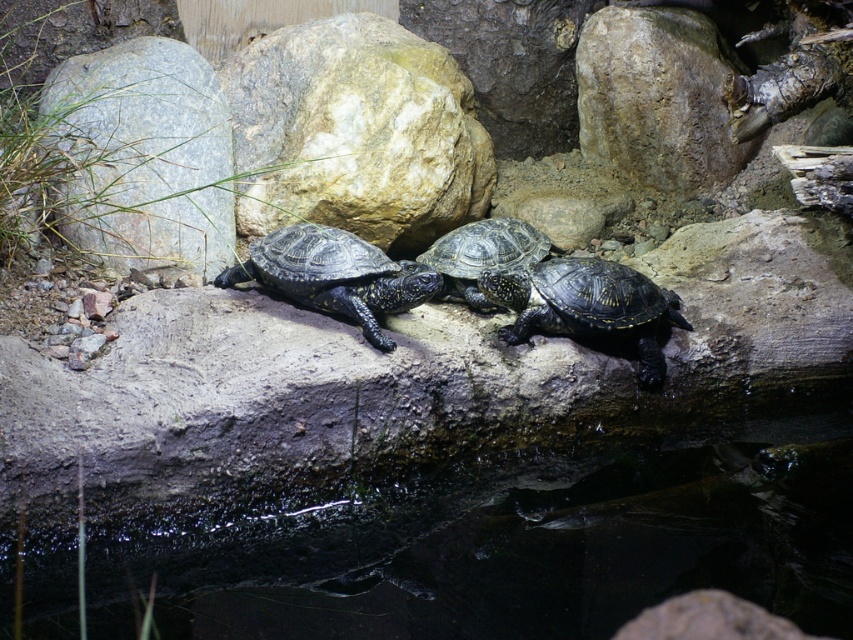
Which is more to the left, speckled rock at center or gray rock at center?

From the viewer's perspective, gray rock at center appears more on the left side.

Does point (381, 188) come in front of point (148, 64)?

Yes, it is.

Which is in front, point (457, 118) or point (172, 60)?

Point (457, 118) is more forward.

The height and width of the screenshot is (640, 853). Identify the location of speckled rock at center. (357, 132).

Does gray rock at center appear on the left side of rough textured rock at upper center?

Yes, gray rock at center is to the left of rough textured rock at upper center.

Describe the element at coordinates (148, 156) in the screenshot. I see `gray rock at center` at that location.

Locate an element on the screen. The width and height of the screenshot is (853, 640). gray rock at center is located at coordinates (148, 156).

Describe the element at coordinates (357, 132) in the screenshot. The image size is (853, 640). I see `speckled rock at center` at that location.

Is speckled rock at center above shiny black turtle at center?

Correct, speckled rock at center is located above shiny black turtle at center.

Between point (242, 189) and point (538, 323), which one is positioned behind?

The point (242, 189) is more distant.

At what (x,y) coordinates should I click in order to perform the action: click on speckled rock at center. Please return your answer as a coordinate pair (x, y). This screenshot has height=640, width=853. Looking at the image, I should click on (357, 132).